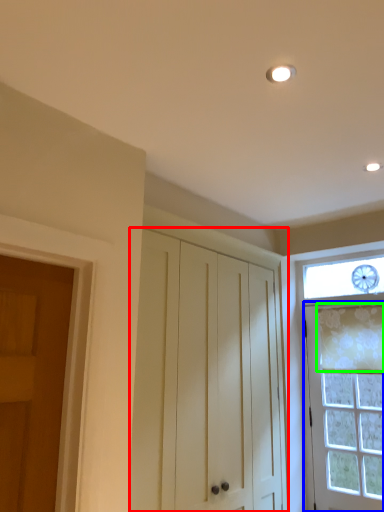
Question: Estimate the real-world distances between objects in this image. Which object is farther from cabinetry (highlighted by a red box), door (highlighted by a blue box) or curtain (highlighted by a green box)?

Choices:
 (A) door
 (B) curtain

Answer: (B)